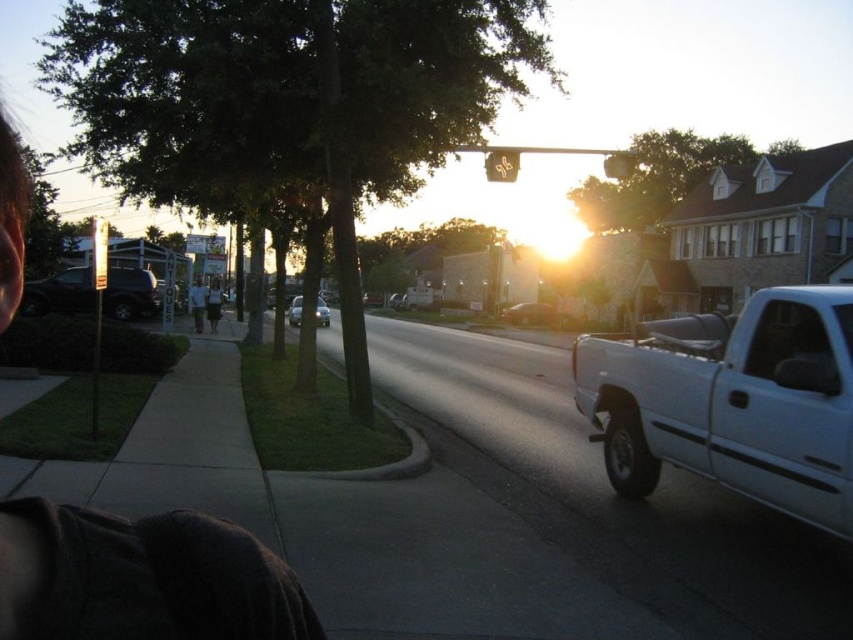
Question: Among these points, which one is nearest to the camera?

Choices:
 (A) (206, 308)
 (B) (546, 304)

Answer: (A)

Question: Which object appears closest to the camera in this image?

Choices:
 (A) white matte truck at right
 (B) metallic gold traffic light at upper center

Answer: (A)

Question: Is matte black suv at left to the right of shiny silver sedan at center from the viewer's perspective?

Choices:
 (A) yes
 (B) no

Answer: (B)

Question: Which object is positioned farthest from the shiny silver sedan at center?

Choices:
 (A) matte black suv at left
 (B) metallic silver sedan at center
 (C) metallic yellow traffic light at upper center

Answer: (C)

Question: Observing the image, what is the correct spatial positioning of metallic silver sedan at center in reference to white cotton dress at center?

Choices:
 (A) below
 (B) above

Answer: (A)

Question: Can you confirm if white matte truck at right is positioned above metallic silver sedan at center?

Choices:
 (A) yes
 (B) no

Answer: (B)